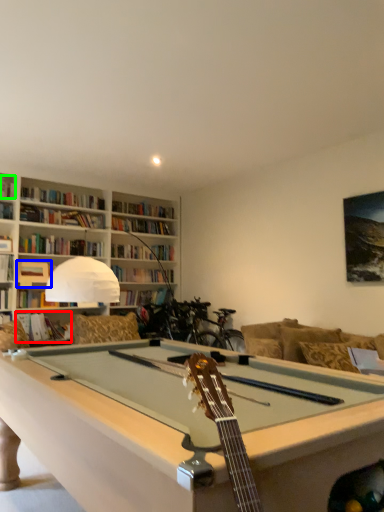
Question: Which object is positioned closest to book (highlighted by a red box)? Select from book (highlighted by a blue box) and book (highlighted by a green box).

Choices:
 (A) book
 (B) book

Answer: (A)